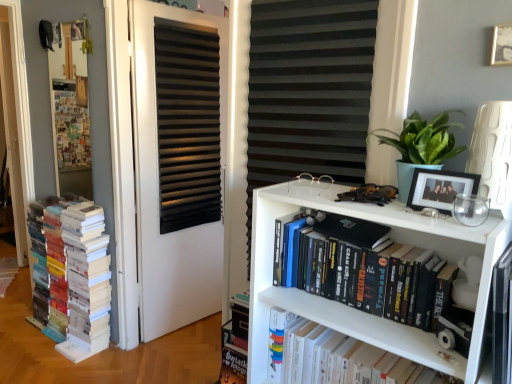
Question: Does point coord(199,292) appear closer or farther from the camera than point coord(459,180)?

Choices:
 (A) closer
 (B) farther

Answer: (B)

Question: From the image's perspective, is black matte door at center positioned above or below black matte picture frame at upper right, the 1th picture frame in the left-to-right sequence?

Choices:
 (A) above
 (B) below

Answer: (B)

Question: Which is nearer to the black matte shutter at center?

Choices:
 (A) black matte bookshelf at center, which is the 2th book in right-to-left order
 (B) multicolored paper books at left, arranged as the 3th book when viewed from the right
 (C) black matte picture frame at upper right, which is the 1th picture frame from bottom to top
 (D) gold metallic picture frame at upper right, the 2th picture frame ordered from the bottom
 (E) white matte bookshelf at center, the 1th book when ordered from right to left

Answer: (A)

Question: Estimate the real-world distances between objects in this image. Which object is farther from the wooden bulletin board at left?

Choices:
 (A) black matte bookshelf at center, which is the 2th book in right-to-left order
 (B) gold metallic picture frame at upper right, positioned as the 1th picture frame in top-to-bottom order
 (C) black matte door at center
 (D) multicolored paper books at left, arranged as the 3th book when viewed from the right
 (E) green matte plant at upper right

Answer: (B)